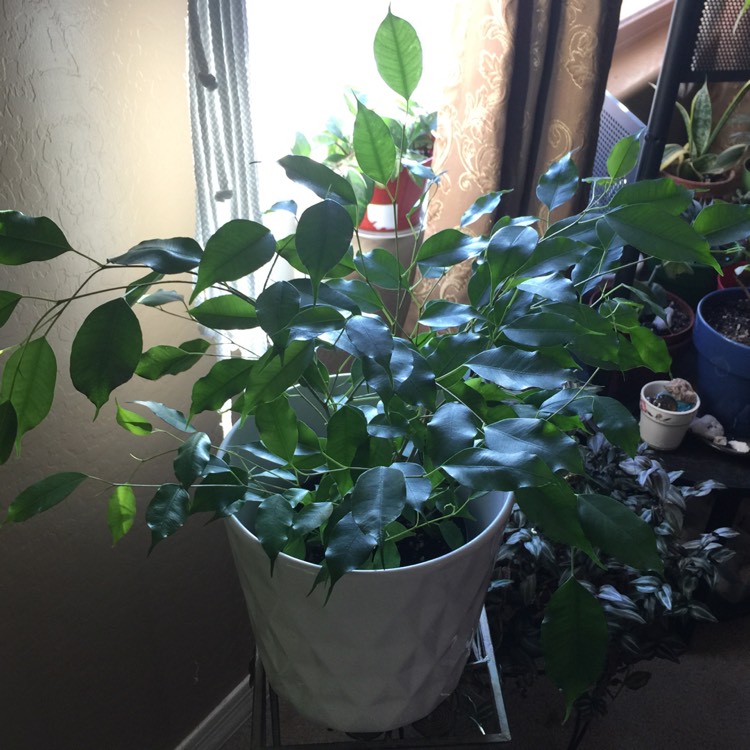
The height and width of the screenshot is (750, 750). Identify the location of ledge. (628, 64).